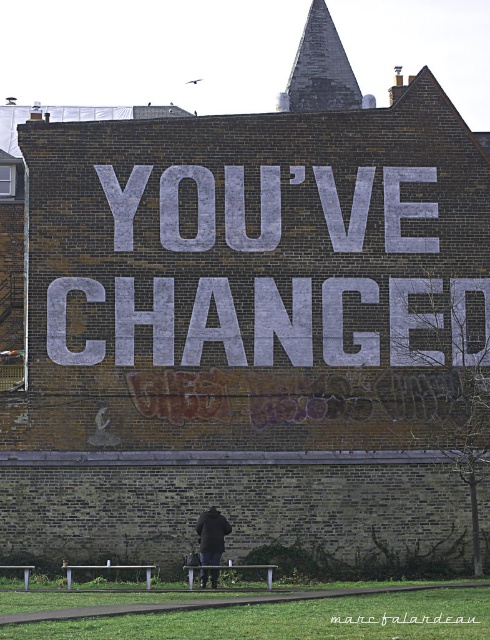
You are standing in front of the brick wall with the message. You notice two points marked on the wall. One is at coordinate point (386, 252) and the other at point (202, 538). Which point is closer to you?

Point (386, 252) is closer to you because it is further to the camera than point (202, 538).

You are a painter who wants to place a new artwork on the brick wall. The artwork requires a space that is wider than the dark blue jacket at center. Can you use the area where the gray concrete text at center is currently located?

The gray concrete text at center might be wider than dark blue jacket at center, so it is possible that the area where the gray concrete text at center is located could accommodate the artwork requiring a space wider than the dark blue jacket at center.